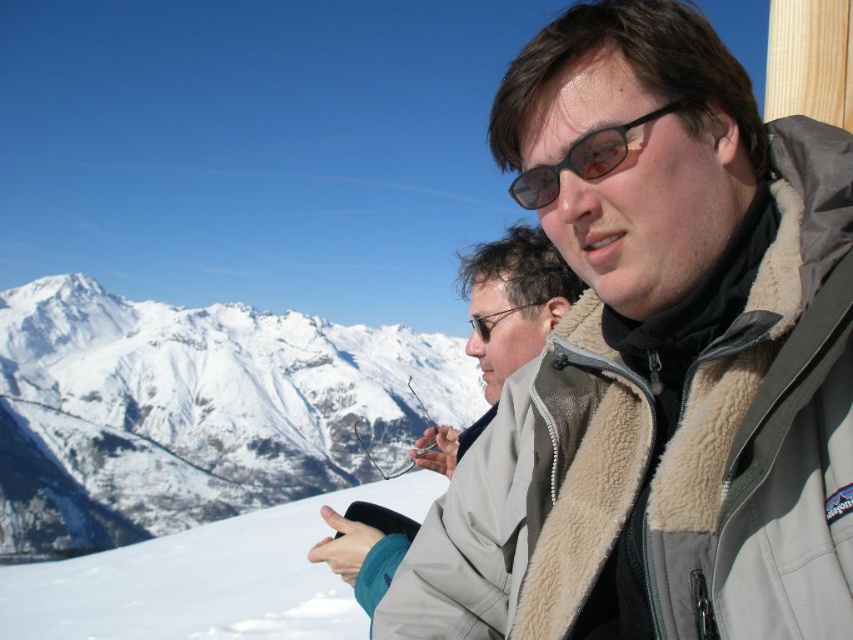
You are standing in a snowy mountain area and want to reach the point marked at coordinates point [97,557]. If you have a map that shows your current position as 100 meters away from that point, is your map accurate?

The point [97,557] is 152.65 meters away from the viewer, so the map showing it as 100 meters away is not accurate.

You are planning to build a snowman using the white fluffy snow at lower left. The snowman requires 3 snowballs stacked vertically, each with a diameter of 30 cm. Given the snow depth at the location is 50 cm, will there be enough snow to build the snowman?

The white fluffy snow at lower left has a depth of 50 cm. Since each snowball requires 30 cm in diameter and three snowballs would need a total of 90 cm, there is insufficient snow depth. Therefore, it is not possible to build the snowman.